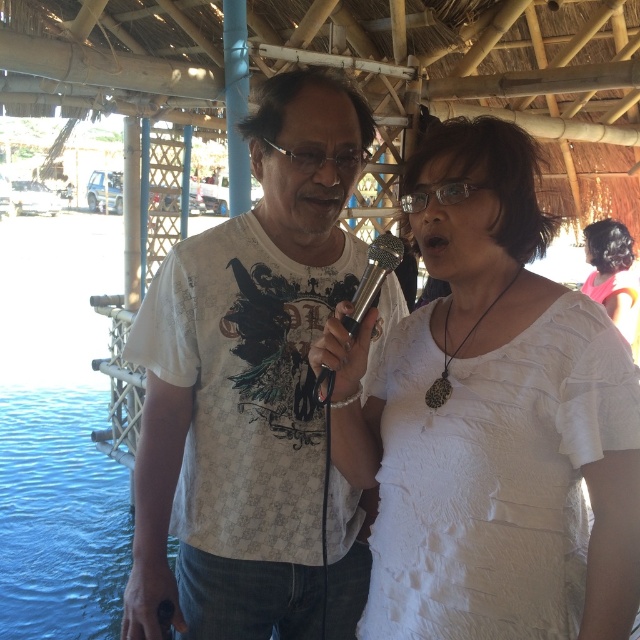
Question: Is white printed t-shirt at center closer to the viewer compared to blue liquid water at lower left?

Choices:
 (A) yes
 (B) no

Answer: (A)

Question: Which object appears closest to the camera in this image?

Choices:
 (A) silver metallic microphone at center
 (B) white fabric shirt at center

Answer: (B)

Question: In this image, where is white fabric shirt at center located relative to dark brown hair at right?

Choices:
 (A) left
 (B) right

Answer: (A)

Question: Estimate the real-world distances between objects in this image. Which object is closer to the white printed t-shirt at center?

Choices:
 (A) dark brown hair at right
 (B) white fabric shirt at center
 (C) blue liquid water at lower left

Answer: (B)

Question: Estimate the real-world distances between objects in this image. Which object is farther from the white fabric shirt at center?

Choices:
 (A) silver metallic microphone at center
 (B) white printed t-shirt at center
 (C) blue liquid water at lower left
 (D) dark brown hair at right

Answer: (C)

Question: From the image, what is the correct spatial relationship of white fabric shirt at center in relation to blue liquid water at lower left?

Choices:
 (A) below
 (B) above

Answer: (B)